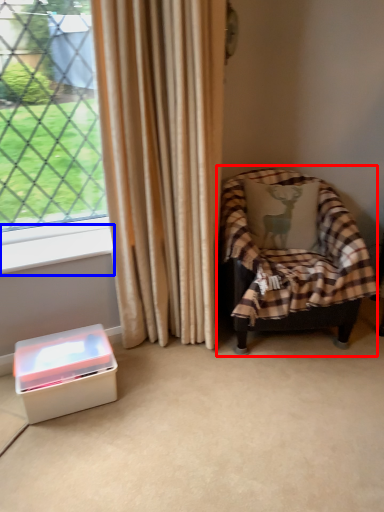
Question: Which object appears closest to the camera in this image, chair (highlighted by a red box) or window sill (highlighted by a blue box)?

Choices:
 (A) chair
 (B) window sill

Answer: (A)